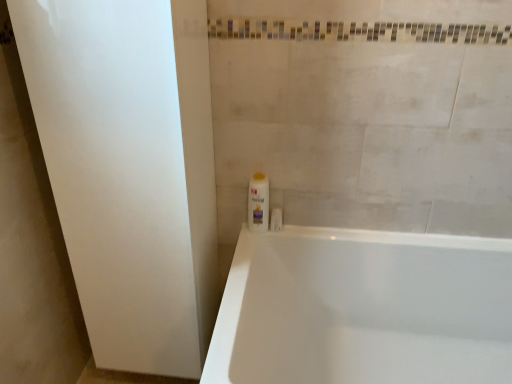
Question: From the image's perspective, is white plastic bottle at center above or below white matte screen door at left?

Choices:
 (A) below
 (B) above

Answer: (B)

Question: Is white plastic bottle at center in front of or behind white matte screen door at left in the image?

Choices:
 (A) front
 (B) behind

Answer: (B)

Question: Which of these objects is positioned closest to the white plastic bottle at center?

Choices:
 (A) white matte screen door at left
 (B) white glossy bathtub at lower right

Answer: (B)

Question: Which of these objects is positioned farthest from the white matte screen door at left?

Choices:
 (A) white glossy bathtub at lower right
 (B) white plastic bottle at center

Answer: (A)